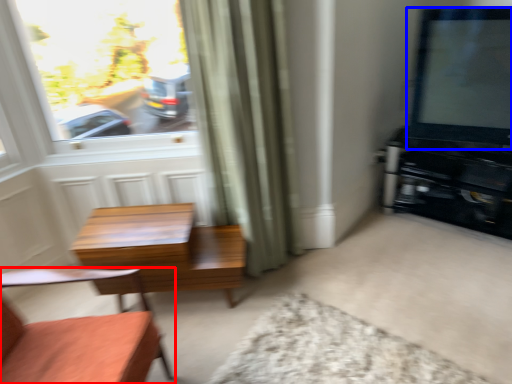
Question: Which object appears closest to the camera in this image, chair (highlighted by a red box) or window screen (highlighted by a blue box)?

Choices:
 (A) chair
 (B) window screen

Answer: (A)